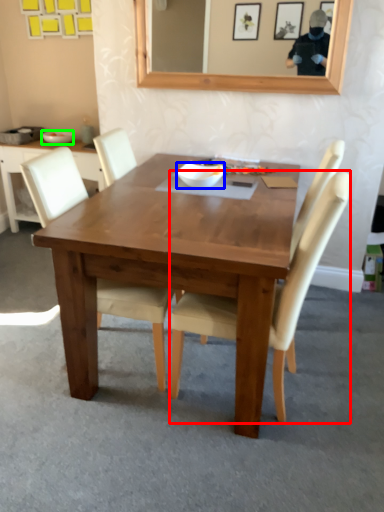
Question: Which object is positioned closest to chair (highlighted by a red box)? Select from bowl (highlighted by a blue box) and bowl (highlighted by a green box).

Choices:
 (A) bowl
 (B) bowl

Answer: (A)